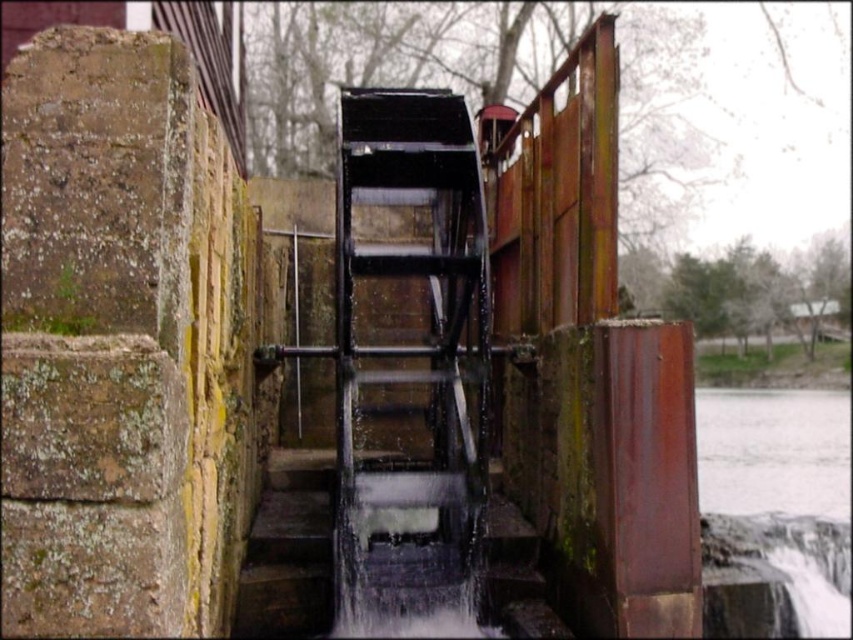
You are standing at the base of the waterwheel and want to cross to the other side. The rusty metal stairs at center are your only path. However, there is white frothy water at lower right nearby. Considering their sizes, which object might pose a greater obstacle to your safe passage?

The white frothy water at lower right has a larger size compared to the rusty metal stairs at center, so it might pose a greater obstacle to your safe passage.

You are standing at the center of the waterwheel and want to reach the point marked at coordinates (775, 512). Which direction should you move to get there?

The point at (775, 512) is located on white frothy water at lower right, so you should move towards the lower right direction from the center of the waterwheel to reach it.